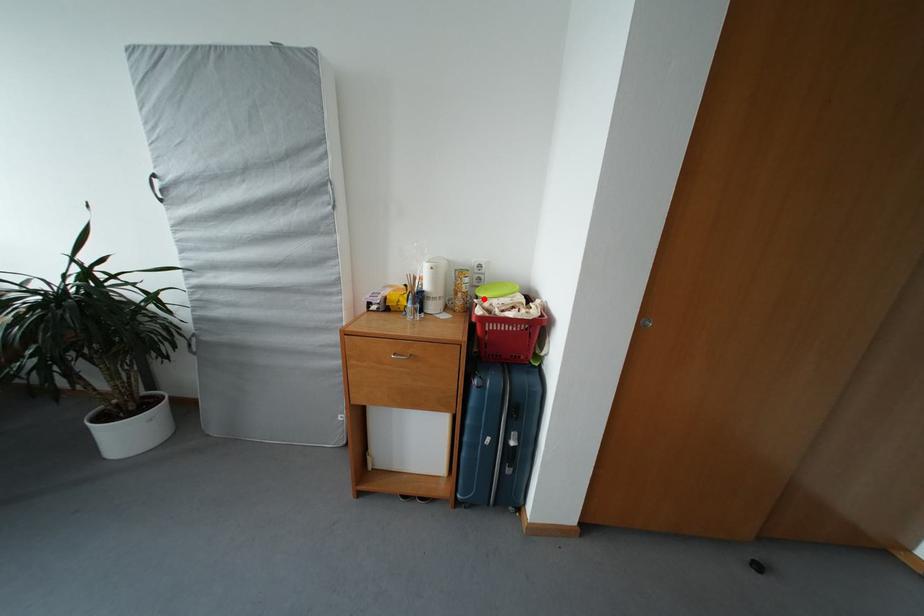
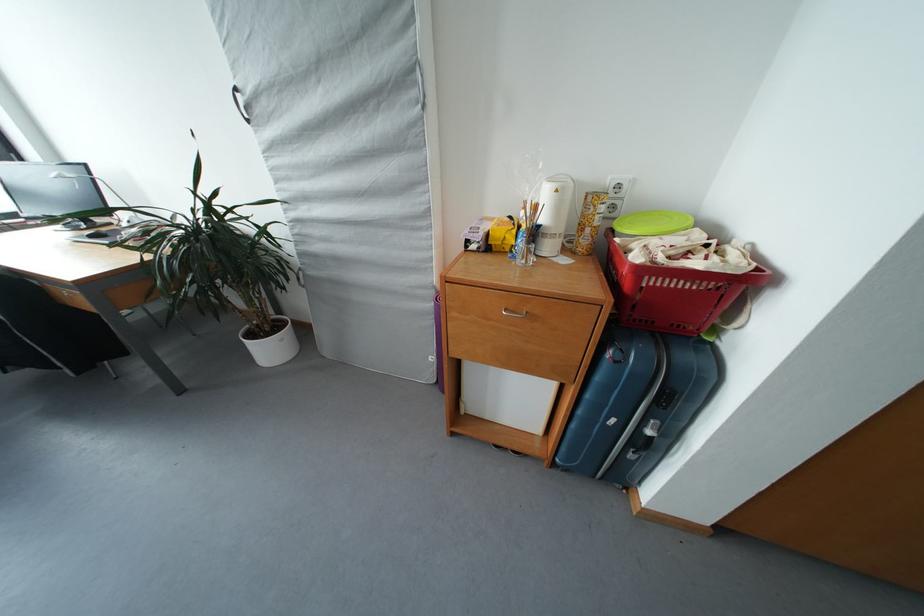
The point at the highlighted location is marked in the first image. Where is the corresponding point in the second image?

(625, 233)